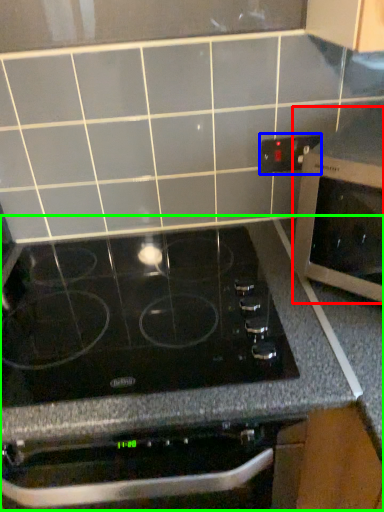
Question: Which object is the closest to the microwave oven (highlighted by a red box)? Choose among these: electric outlet (highlighted by a blue box) or counter (highlighted by a green box).

Choices:
 (A) electric outlet
 (B) counter

Answer: (B)